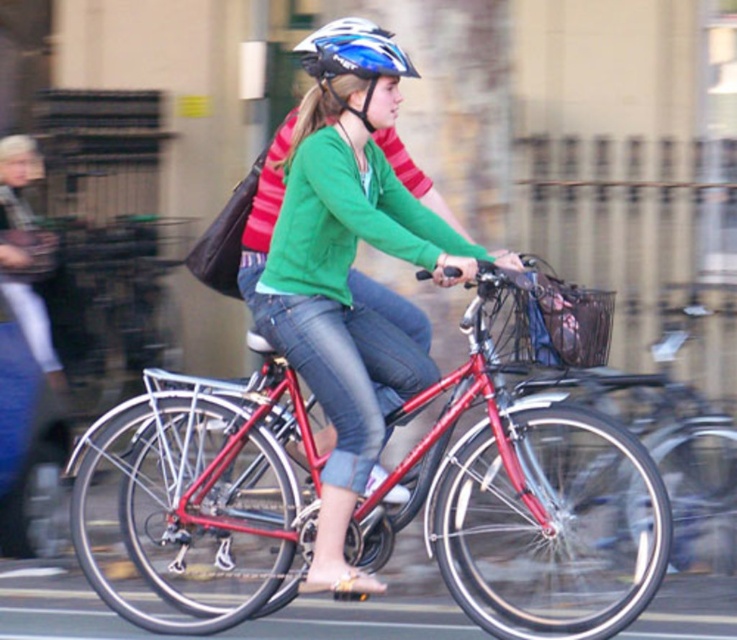
You are standing at the starting line of a bicycle race and see two points marked on the track ahead of you. The first point is at coordinates point [593,435] and the second point is at point [332,29]. Which point is closer to you?

Point [332,29] is closer to you because it is less further than point [593,435].

You are a delivery person trying to navigate through a narrow alley. You see a matte green sweater at center and a blue matte helmet at upper center in your path. Which object do you need to avoid hitting if you want to pass through without turning?

The matte green sweater at center might be wider than the blue matte helmet at upper center, so you should avoid hitting the matte green sweater at center as it occupies more space in the path.

You are a delivery person who needs to choose a bicycle to carry a heavy package. The shiny metallic bicycle at center and the matte green sweater at center are available. Which bicycle has a lower height to ensure better stability?

The shiny metallic bicycle at center has a lesser height compared to matte green sweater at center, so it is the better choice for stability.